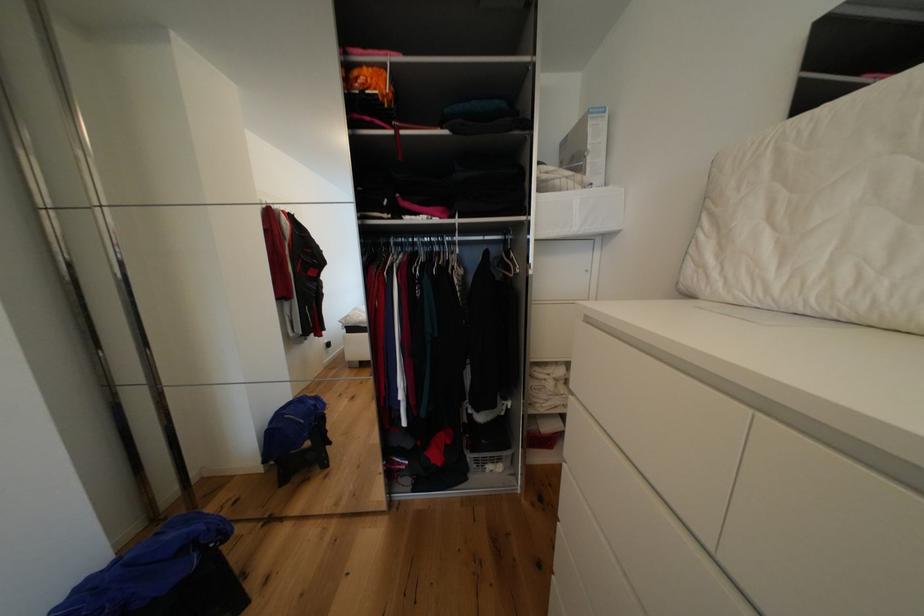
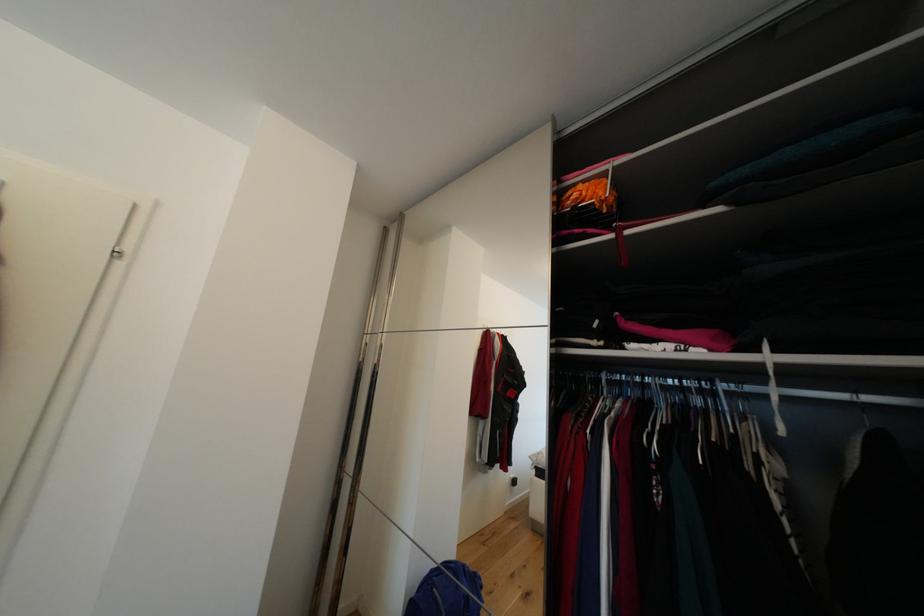
Locate, in the second image, the point that corresponds to point (273, 430) in the first image.

(421, 592)